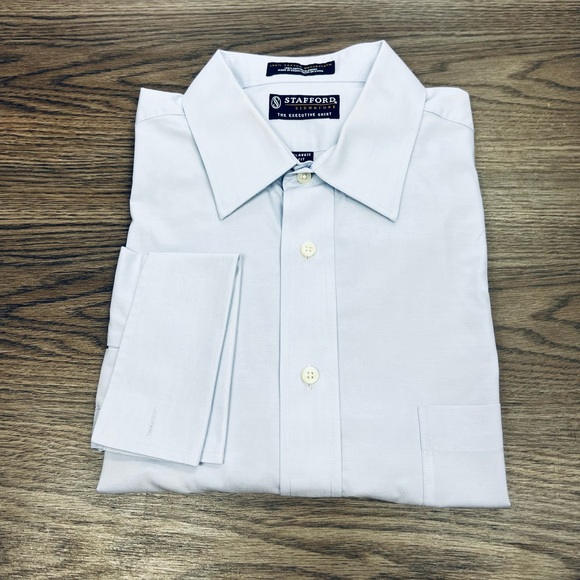
Where is `wood floor`? wood floor is located at coordinates (542, 213), (10, 403).